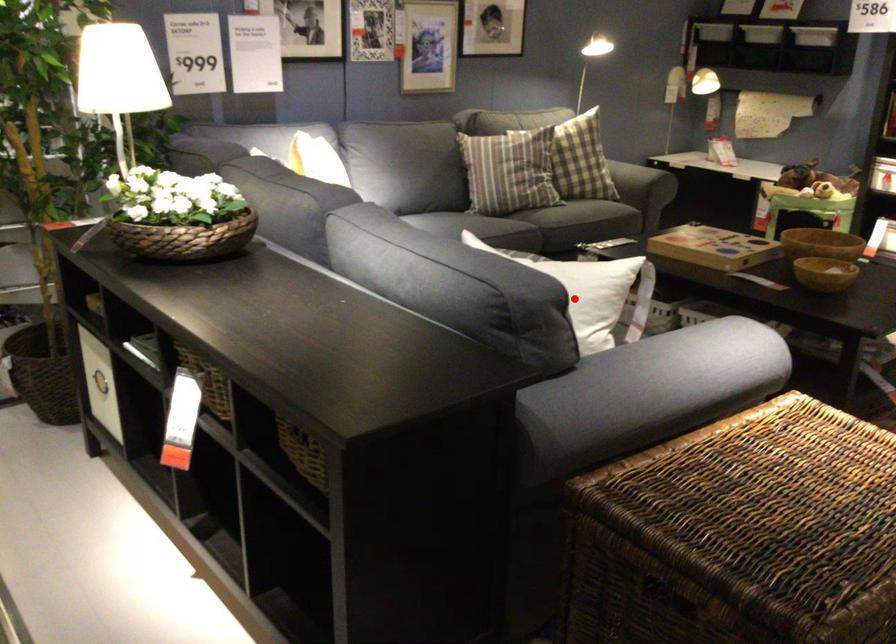
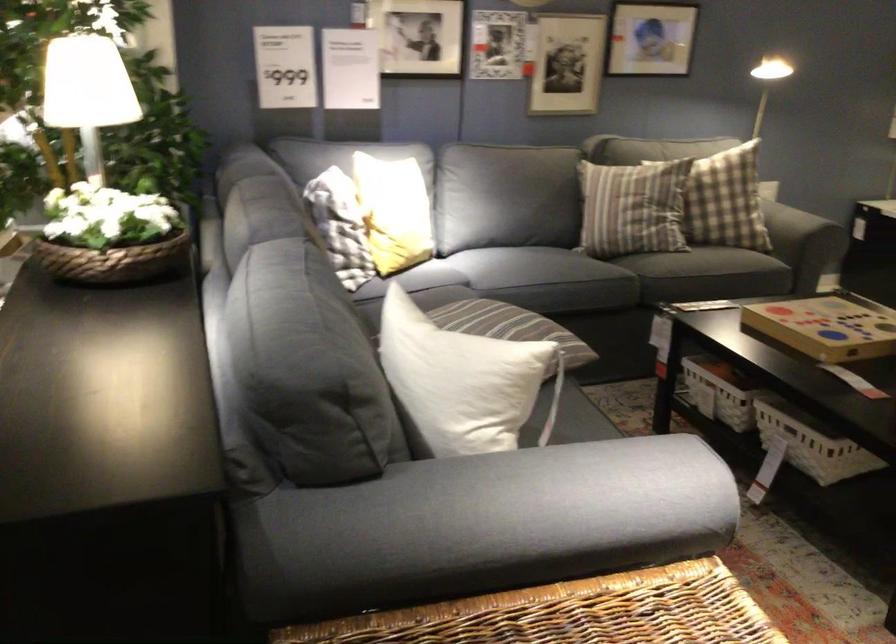
Find the pixel in the second image that matches the highlighted location in the first image.

(462, 381)